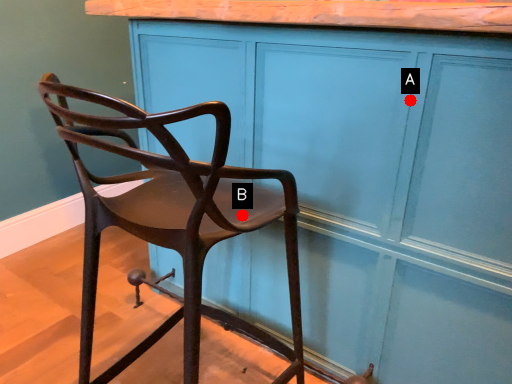
Question: Two points are circled on the image, labeled by A and B beside each circle. Which point appears farthest from the camera in this image?

Choices:
 (A) A is further
 (B) B is further

Answer: (A)